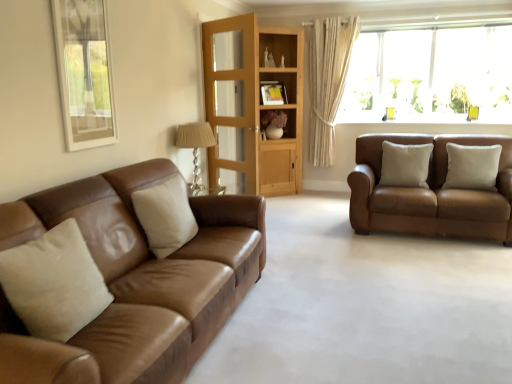
Question: From the image's perspective, is brown leather couch at right, which is the 1th studio couch in back-to-front order, above or below light wood cabinet at center?

Choices:
 (A) below
 (B) above

Answer: (A)

Question: From a real-world perspective, is brown leather couch at right, which is the 1th studio couch in back-to-front order, positioned above or below light wood cabinet at center?

Choices:
 (A) above
 (B) below

Answer: (B)

Question: Estimate the real-world distances between objects in this image. Which object is farther from the beige fabric curtain at upper right?

Choices:
 (A) beige leather pillow at right, placed as the fourth pillow when sorted from left to right
 (B) matte brown leather couch at left, the 2th studio couch positioned from the right
 (C) beige fabric pillow at left, the 4th pillow from the back
 (D) light wood cabinet at center
 (E) translucent glass window at upper right

Answer: (C)

Question: Considering the real-world distances, which object is farthest from the matte brown shelf at center?

Choices:
 (A) matte brown leather couch at left, which is the second studio couch in back-to-front order
 (B) beige fabric pillow at left, which ranks as the 4th pillow in right-to-left order
 (C) beige fabric curtain at upper right
 (D) translucent glass window at upper right
 (E) transparent glass door at center

Answer: (B)